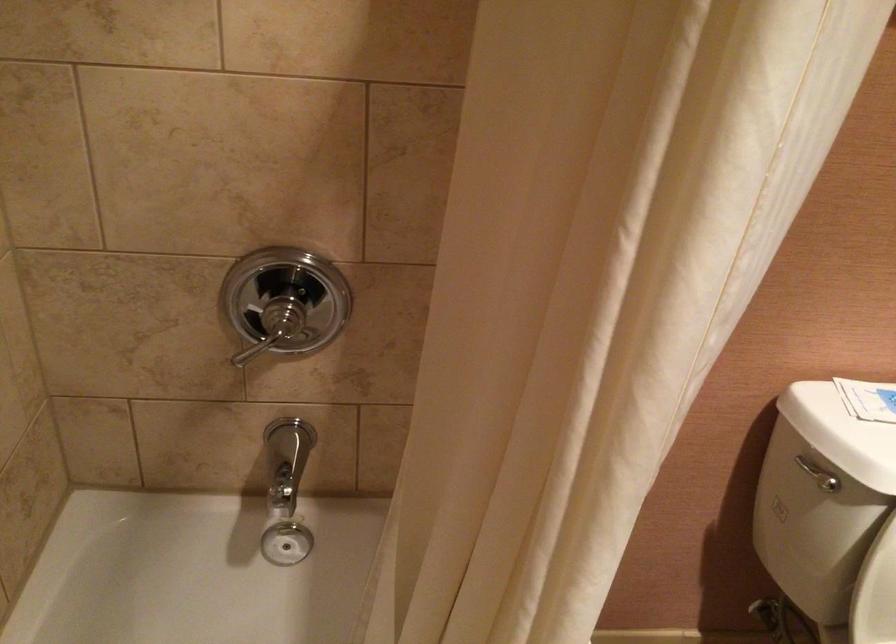
Describe the element at coordinates (273, 327) in the screenshot. I see `a shower control handle` at that location.